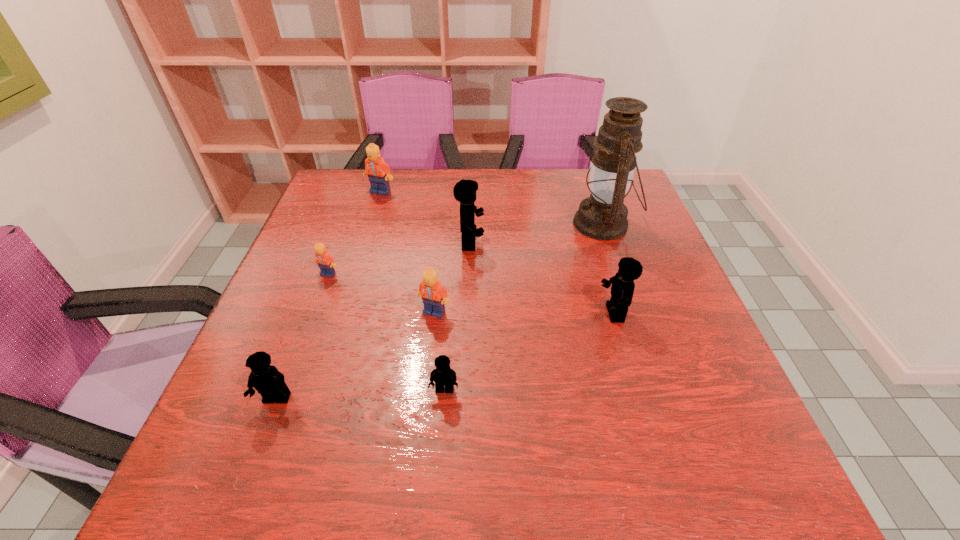
You are a GUI agent. You are given a task and a screenshot of the screen. Output one action in this format:
    pyautogui.click(x=<x>, y=<y>)
    Task: Click on the second farthest orange Lego
    This screenshot has width=960, height=540.
    Given the screenshot: What is the action you would take?
    pyautogui.click(x=326, y=263)

Locate an element on the screen. This screenshot has height=540, width=960. the fifth nearest object is located at coordinates (326, 263).

Identify the location of the smallest yellow Lego. Image resolution: width=960 pixels, height=540 pixels. (443, 375).

Where is `vacant area situated on the left of the oil lamp`? This screenshot has width=960, height=540. vacant area situated on the left of the oil lamp is located at coordinates (441, 224).

Where is `free spot located 0.100m on the front-facing side of the seventh shortest object`? The height and width of the screenshot is (540, 960). free spot located 0.100m on the front-facing side of the seventh shortest object is located at coordinates (523, 243).

This screenshot has height=540, width=960. Find the location of `free region located on the front-facing side of the farthest object`. free region located on the front-facing side of the farthest object is located at coordinates (367, 238).

This screenshot has height=540, width=960. I want to click on vacant space situated 0.180m on the front-facing side of the third smallest yellow Lego, so click(x=516, y=313).

This screenshot has height=540, width=960. I want to click on vacant space located on the front-facing side of the third smallest yellow Lego, so click(507, 313).

Locate an element on the screen. free space located on the front-facing side of the third smallest yellow Lego is located at coordinates (484, 313).

This screenshot has width=960, height=540. I want to click on free space located on the front-facing side of the rightmost orange Lego, so click(424, 407).